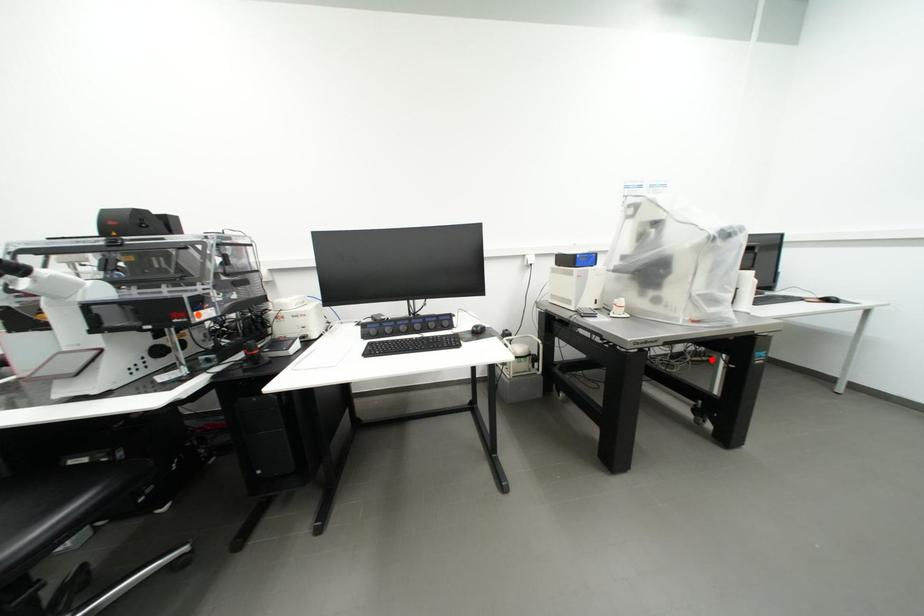
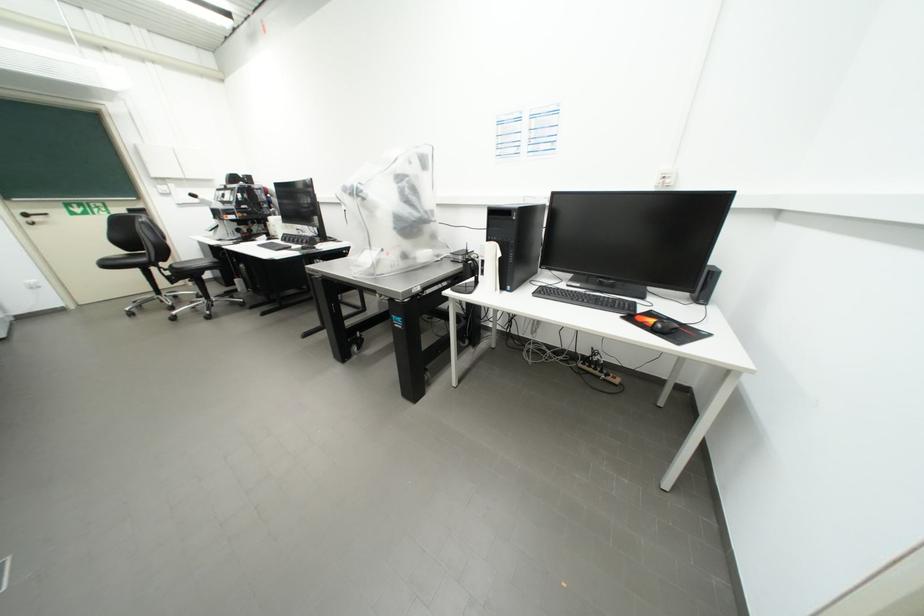
Locate, in the second image, the point that corresponds to the highlighted location in the first image.

(603, 374)